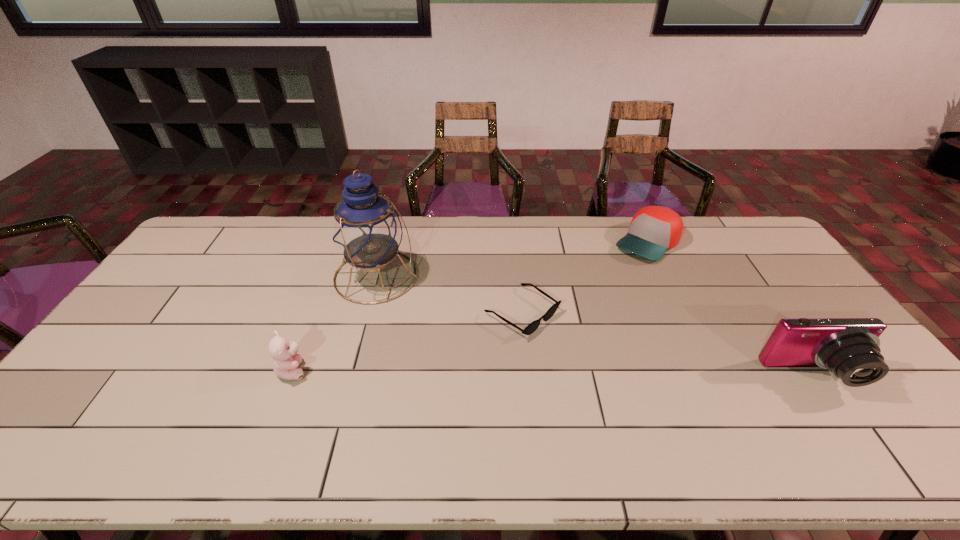
Find the location of a particular element. This screenshot has height=540, width=960. free space located on the front-facing side of the shortest object is located at coordinates (660, 403).

At what (x,y) coordinates should I click in order to perform the action: click on free region located 0.360m at the brim of the baseball cap. Please return your answer as a coordinate pair (x, y). Looking at the image, I should click on (576, 317).

The image size is (960, 540). I want to click on free point located at the brim of the baseball cap, so click(x=612, y=280).

Where is `free space located 0.220m at the brim of the baseball cap`? The height and width of the screenshot is (540, 960). free space located 0.220m at the brim of the baseball cap is located at coordinates (600, 293).

Where is `vacant region located 0.120m on the front-facing side of the tallest object`? The image size is (960, 540). vacant region located 0.120m on the front-facing side of the tallest object is located at coordinates pos(437,308).

Locate an element on the screen. vacant point located 0.070m on the front-facing side of the tallest object is located at coordinates (424, 301).

Where is `free space located on the front-facing side of the tallest object`? The height and width of the screenshot is (540, 960). free space located on the front-facing side of the tallest object is located at coordinates (449, 315).

Where is `baseball cap that is at the far edge`? This screenshot has width=960, height=540. baseball cap that is at the far edge is located at coordinates (654, 229).

Identify the location of lantern at the far edge. (367, 230).

You are a GUI agent. You are given a task and a screenshot of the screen. Output one action in this format:
    pyautogui.click(x=<x>, y=<y>)
    Task: Click on the object present at the near edge
    Image resolution: width=960 pixels, height=540 pixels.
    Given the screenshot: What is the action you would take?
    pyautogui.click(x=849, y=347)